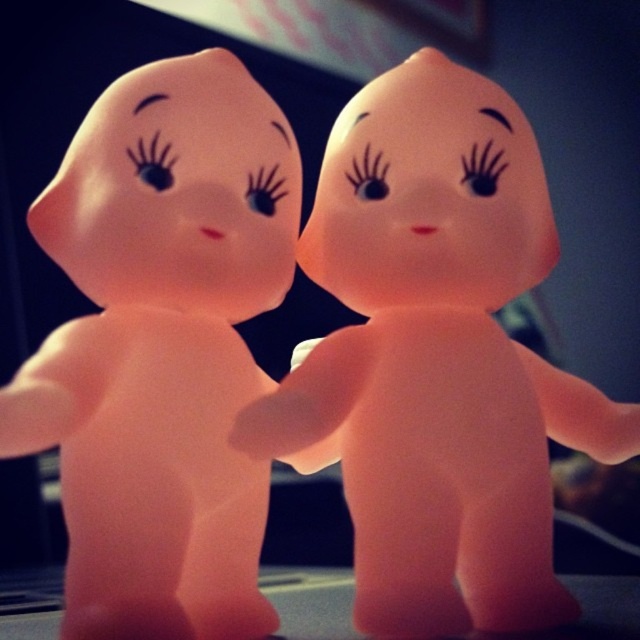
The width and height of the screenshot is (640, 640). What do you see at coordinates (435, 358) in the screenshot?
I see `pink rubber doll at center` at bounding box center [435, 358].

Does pink rubber doll at center appear on the right side of pink rubber figurine at center?

Indeed, pink rubber doll at center is positioned on the right side of pink rubber figurine at center.

Where is `pink rubber doll at center`? The image size is (640, 640). pink rubber doll at center is located at coordinates (435, 358).

The width and height of the screenshot is (640, 640). Identify the location of pink rubber doll at center. (435, 358).